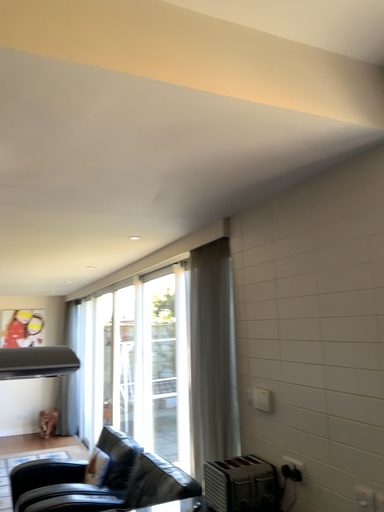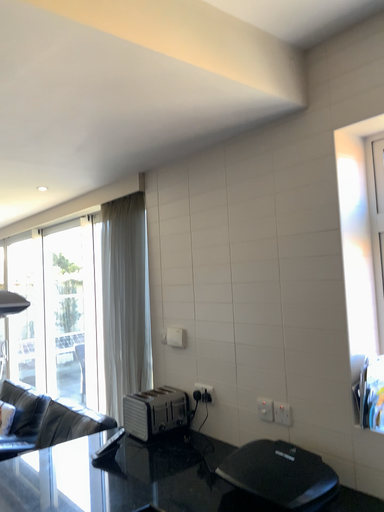
Question: How did the camera likely rotate when shooting the video?

Choices:
 (A) rotated right
 (B) rotated left

Answer: (A)